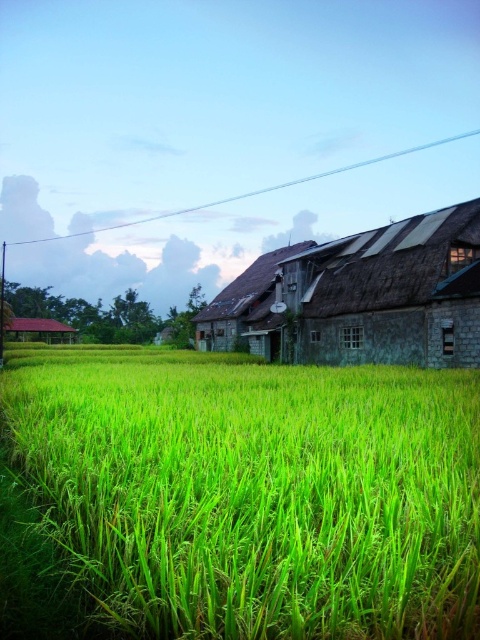
Question: Is green grassy field at center positioned before rusty corrugated metal barn at center?

Choices:
 (A) no
 (B) yes

Answer: (B)

Question: Is green grassy field at center smaller than rusty corrugated metal barn at center?

Choices:
 (A) yes
 (B) no

Answer: (A)

Question: Is green grassy field at center thinner than rusty corrugated metal barn at center?

Choices:
 (A) no
 (B) yes

Answer: (B)